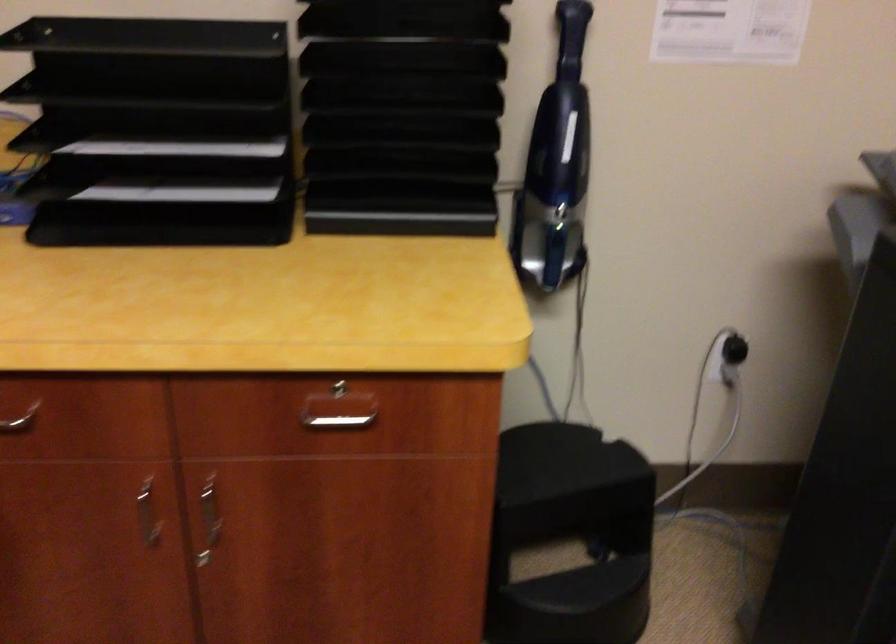
The width and height of the screenshot is (896, 644). In order to click on drawer keyhole in this screenshot , I will do `click(342, 391)`.